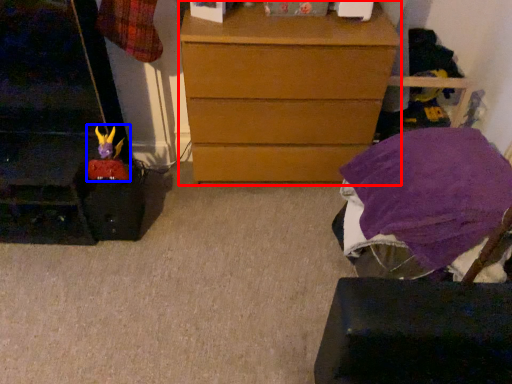
Question: Which object appears closest to the camera in this image, chest of drawers (highlighted by a red box) or toy (highlighted by a blue box)?

Choices:
 (A) chest of drawers
 (B) toy

Answer: (A)